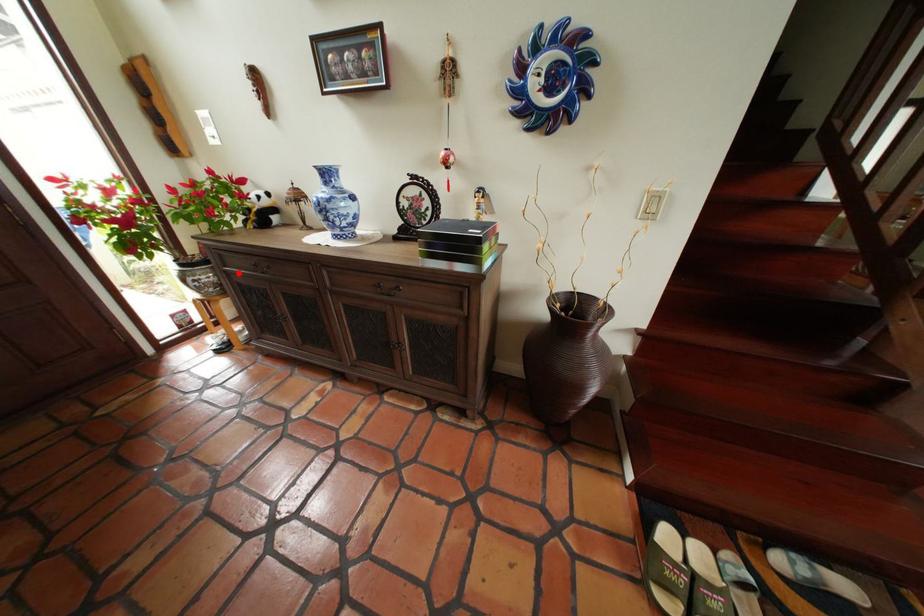
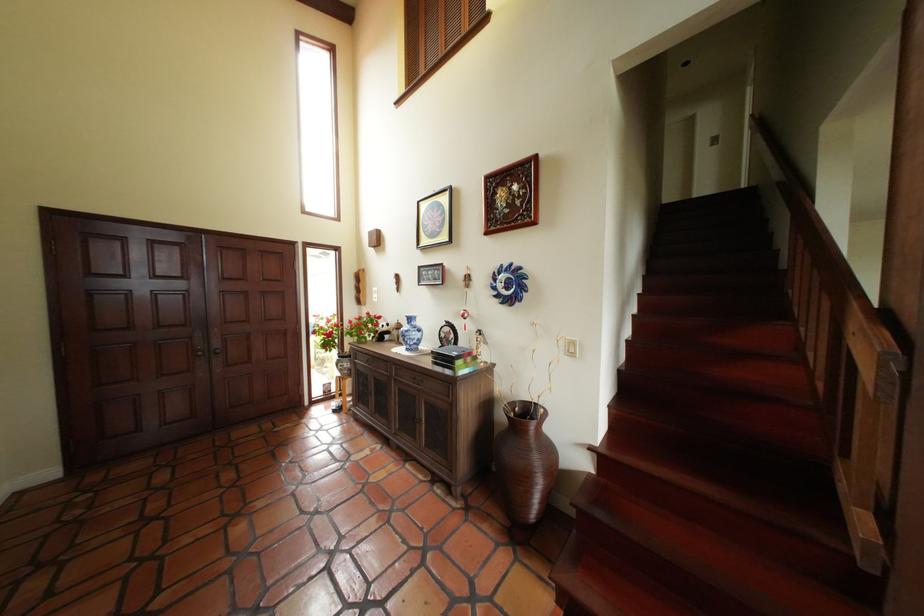
Question: A red point is marked in image1. In image2, is the corresponding 3D point closer to the camera or farther? Reply with the corresponding letter.

Choices:
 (A) The corresponding 3D point is closer.
 (B) The corresponding 3D point is farther.

Answer: (B)